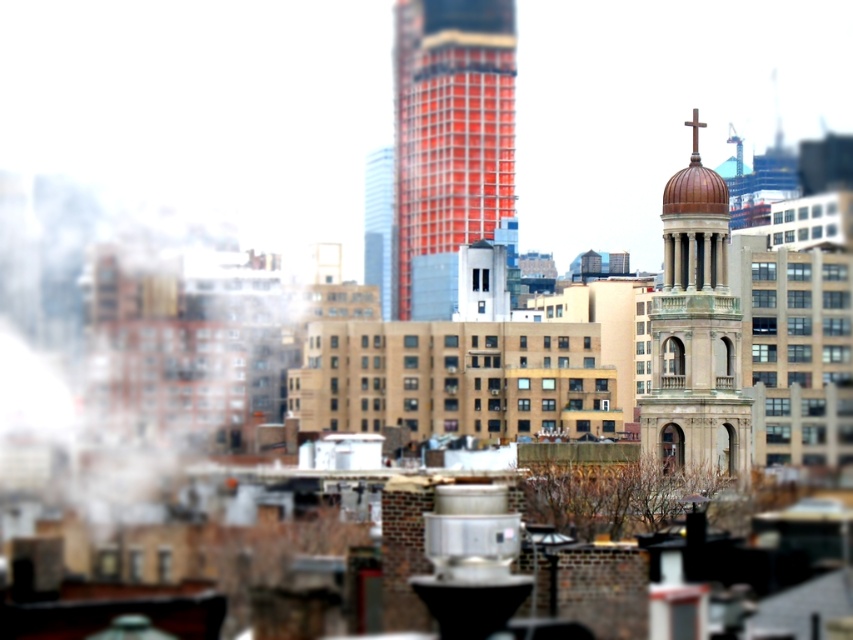
Question: Does red glass skyscraper at center lie behind bronze domed tower at center right?

Choices:
 (A) yes
 (B) no

Answer: (A)

Question: Which of the following is the closest to the observer?

Choices:
 (A) red glass skyscraper at center
 (B) bronze domed tower at center right
 (C) glassy orange skyscraper at center

Answer: (B)

Question: Is red glass skyscraper at center smaller than glassy orange skyscraper at center?

Choices:
 (A) yes
 (B) no

Answer: (B)

Question: Is red glass skyscraper at center smaller than bronze domed tower at center right?

Choices:
 (A) yes
 (B) no

Answer: (A)

Question: Which point appears farthest from the camera in this image?

Choices:
 (A) (438, 252)
 (B) (680, 422)
 (C) (392, 266)

Answer: (C)

Question: Which point is farther to the camera?

Choices:
 (A) (364, 182)
 (B) (654, 301)
 (C) (492, 204)

Answer: (A)